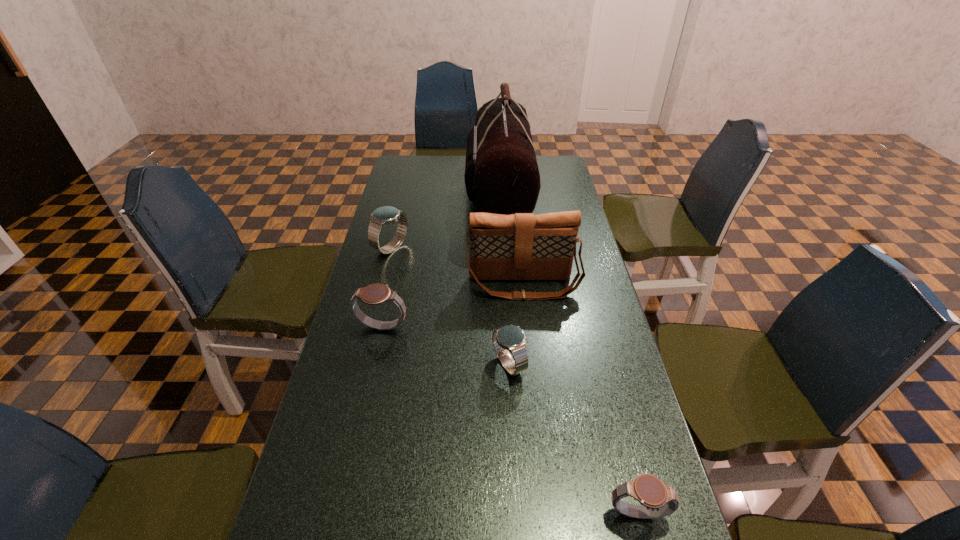
This screenshot has width=960, height=540. I want to click on vacant area that lies between the duffel bag and the bigger gray watch, so click(441, 258).

Locate which object is the closest to the farthest watch. Please provide its 2D coordinates. Your answer should be formatted as a tuple, i.e. [(x, y)], where the tuple contains the x and y coordinates of a point satisfying the conditions above.

[(501, 175)]

Locate an element on the screen. the fifth closest object to the red duffel bag is located at coordinates (657, 499).

Select which watch appears as the third closest to the second nearest watch. Please provide its 2D coordinates. Your answer should be formatted as a tuple, i.e. [(x, y)], where the tuple contains the x and y coordinates of a point satisfying the conditions above.

[(375, 294)]

Identify which watch is the fourth closest to the fourth farthest object. Please provide its 2D coordinates. Your answer should be formatted as a tuple, i.e. [(x, y)], where the tuple contains the x and y coordinates of a point satisfying the conditions above.

[(657, 499)]

Locate which blue watch is the closest to the fifth nearest object. Please provide its 2D coordinates. Your answer should be formatted as a tuple, i.e. [(x, y)], where the tuple contains the x and y coordinates of a point satisfying the conditions above.

[(511, 338)]

Select which blue watch appears as the second closest to the fifth farthest object. Please provide its 2D coordinates. Your answer should be formatted as a tuple, i.e. [(x, y)], where the tuple contains the x and y coordinates of a point satisfying the conditions above.

[(386, 215)]

At what (x,y) coordinates should I click in order to perform the action: click on vacant space that satisfies the following two spatial constraints: 1. on the front pocket of the tallest object; 2. on the front side of the third farthest watch. Please return your answer as a coordinate pair (x, y). The height and width of the screenshot is (540, 960). Looking at the image, I should click on (510, 364).

Where is `vacant space that satisfies the following two spatial constraints: 1. on the front side of the right gray watch; 2. on the right side of the leftmost blue watch`? vacant space that satisfies the following two spatial constraints: 1. on the front side of the right gray watch; 2. on the right side of the leftmost blue watch is located at coordinates (324, 515).